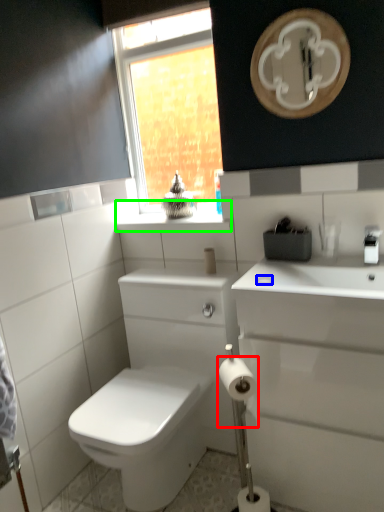
Question: Which object is positioned farthest from toilet paper (highlighted by a red box)? Select from soap (highlighted by a blue box) and counter top (highlighted by a green box).

Choices:
 (A) soap
 (B) counter top

Answer: (B)